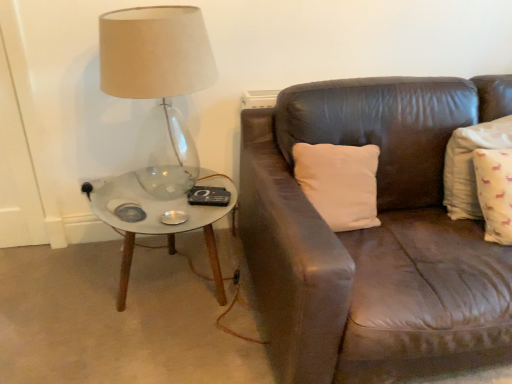
Locate an element on the screen. Image resolution: width=512 pixels, height=384 pixels. translucent glass lamp at left is located at coordinates (158, 85).

What do you see at coordinates (158, 85) in the screenshot?
I see `translucent glass lamp at left` at bounding box center [158, 85].

What is the approximate width of white cotton pillow at right?

white cotton pillow at right is 14.40 inches wide.

Describe the element at coordinates (159, 220) in the screenshot. The image size is (512, 384). I see `white marble coffee table at left` at that location.

Locate an element on the screen. The image size is (512, 384). white marble coffee table at left is located at coordinates (159, 220).

The image size is (512, 384). Find the location of `translucent glass lamp at left`. translucent glass lamp at left is located at coordinates (158, 85).

Does white cotton pillow at right contain white marble coffee table at left?

No, white marble coffee table at left is not a part of white cotton pillow at right.

From a real-world perspective, which is physically below, white cotton pillow at right or white marble coffee table at left?

In real-world perspective, white marble coffee table at left is lower.

Between white cotton pillow at right and white marble coffee table at left, which one has smaller size?

With smaller size is white cotton pillow at right.

Is translucent glass lamp at left facing away from white cotton pillow at right?

translucent glass lamp at left does not have its back to white cotton pillow at right.

From a real-world perspective, who is located higher, translucent glass lamp at left or white cotton pillow at right?

In real-world perspective, translucent glass lamp at left is above.

Between white marble coffee table at left and translucent glass lamp at left, which one has less height?

white marble coffee table at left is shorter.

Does white marble coffee table at left have a greater width compared to translucent glass lamp at left?

Yes.

Which is more to the right, white marble coffee table at left or translucent glass lamp at left?

translucent glass lamp at left is more to the right.

This screenshot has width=512, height=384. I want to click on lamp above the white marble coffee table at left (from the image's perspective), so click(x=158, y=85).

Locate an element on the screen. lamp in front of the white cotton pillow at right is located at coordinates (158, 85).

Can you confirm if white cotton pillow at right is shorter than translucent glass lamp at left?

Indeed, white cotton pillow at right has a lesser height compared to translucent glass lamp at left.

Can you confirm if white cotton pillow at right is thinner than translucent glass lamp at left?

Indeed, white cotton pillow at right has a lesser width compared to translucent glass lamp at left.

Considering the positions of objects white cotton pillow at right and translucent glass lamp at left in the image provided, who is in front, white cotton pillow at right or translucent glass lamp at left?

translucent glass lamp at left is more forward.

Is point (105, 68) positioned behind point (98, 184)?

No, (105, 68) is in front of (98, 184).

Does translucent glass lamp at left have a larger size compared to white marble coffee table at left?

Indeed, translucent glass lamp at left has a larger size compared to white marble coffee table at left.

Is white marble coffee table at left at the back of translucent glass lamp at left?

No, white marble coffee table at left is not at the back of translucent glass lamp at left.

Based on the photo, from the image's perspective, relative to white marble coffee table at left, is translucent glass lamp at left above or below?

translucent glass lamp at left is above white marble coffee table at left.

From the image's perspective, is white marble coffee table at left on top of white cotton pillow at right?

Incorrect, from the image's perspective, white marble coffee table at left is lower than white cotton pillow at right.

How far apart are white marble coffee table at left and white cotton pillow at right?

white marble coffee table at left is 3.38 feet from white cotton pillow at right.

Locate an element on the screen. Image resolution: width=512 pixels, height=384 pixels. pillow above the white marble coffee table at left (from the image's perspective) is located at coordinates (470, 164).

Is white marble coffee table at left in contact with white cotton pillow at right?

No, white marble coffee table at left is not with white cotton pillow at right.

In order to click on coffee table that is on the left side of white cotton pillow at right in this screenshot , I will do `click(159, 220)`.

This screenshot has width=512, height=384. I want to click on pillow below the translucent glass lamp at left (from a real-world perspective), so click(470, 164).

Which object lies nearer to the anchor point white marble coffee table at left, white cotton pillow at right or translucent glass lamp at left?

translucent glass lamp at left lies closer to white marble coffee table at left than the other object.

Looking at the image, which one is located further to white cotton pillow at right, translucent glass lamp at left or white marble coffee table at left?

translucent glass lamp at left.

Based on their spatial positions, is white marble coffee table at left or white cotton pillow at right closer to translucent glass lamp at left?

white marble coffee table at left is closer to translucent glass lamp at left.

In the scene shown: Based on their spatial positions, is white cotton pillow at right or white marble coffee table at left closer to translucent glass lamp at left?

Among the two, white marble coffee table at left is located nearer to translucent glass lamp at left.

Estimate the real-world distances between objects in this image. Which object is closer to white marble coffee table at left, translucent glass lamp at left or white cotton pillow at right?

Based on the image, translucent glass lamp at left appears to be nearer to white marble coffee table at left.

From the image, which object appears to be farther from white cotton pillow at right, white marble coffee table at left or translucent glass lamp at left?

translucent glass lamp at left is positioned further to the anchor white cotton pillow at right.

This screenshot has height=384, width=512. Find the location of `lamp between white marble coffee table at left and white cotton pillow at right`. lamp between white marble coffee table at left and white cotton pillow at right is located at coordinates (158, 85).